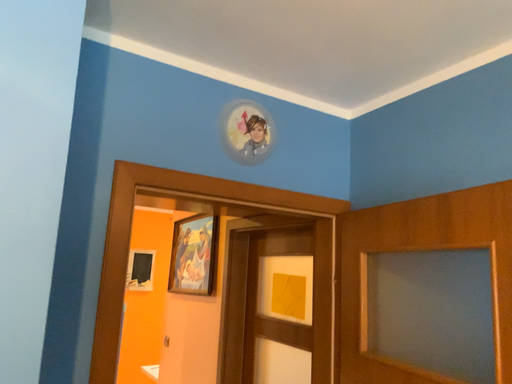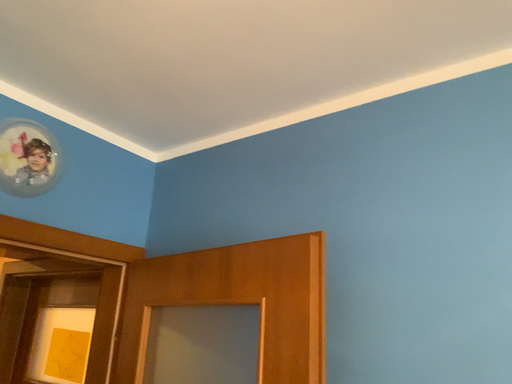
Question: How did the camera likely rotate when shooting the video?

Choices:
 (A) rotated left
 (B) rotated right

Answer: (B)